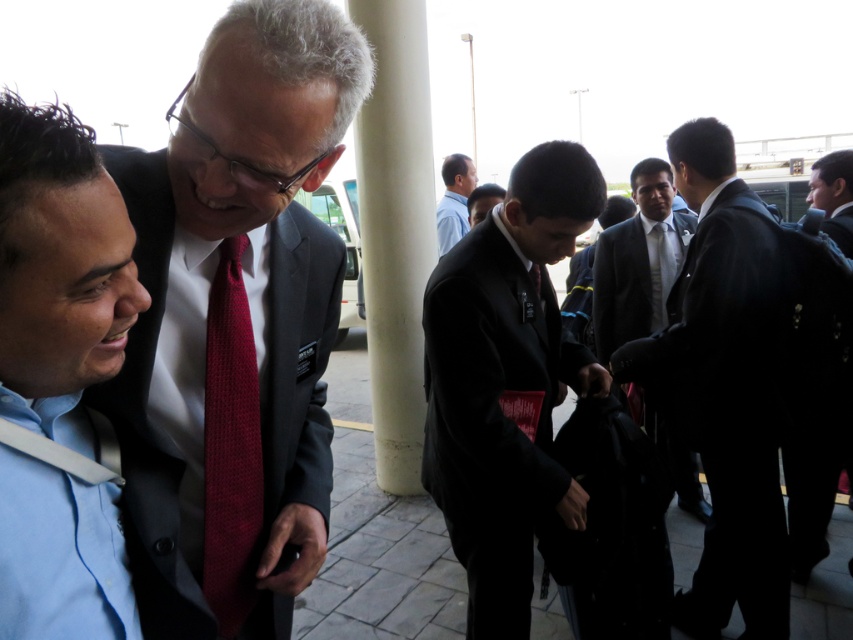
This screenshot has height=640, width=853. What are the coordinates of `matte black suit at center` in the screenshot? It's located at (235, 323).

Which is more to the right, matte black suit at center or black matte suit at center?

black matte suit at center

You are a GUI agent. You are given a task and a screenshot of the screen. Output one action in this format:
    pyautogui.click(x=<x>, y=<y>)
    Task: Click on the matte black suit at center
    Image resolution: width=853 pixels, height=640 pixels.
    Given the screenshot: What is the action you would take?
    pyautogui.click(x=235, y=323)

Where is `matte black suit at center`? The image size is (853, 640). matte black suit at center is located at coordinates (235, 323).

Is dark gray suit at center thinner than dark blue suit at center?

In fact, dark gray suit at center might be wider than dark blue suit at center.

Does dark gray suit at center have a greater width compared to dark blue suit at center?

Yes.

Is point (688, 467) farther from camera compared to point (485, 208)?

That is True.

The height and width of the screenshot is (640, 853). Identify the location of dark gray suit at center. (637, 260).

Can you confirm if matte black suit at center is positioned to the right of dark blue suit at center?

In fact, matte black suit at center is to the left of dark blue suit at center.

Which is more to the left, matte black suit at center or dark blue suit at center?

Positioned to the left is matte black suit at center.

Who is more distant from viewer, (257, 145) or (469, 227)?

Point (469, 227)

The height and width of the screenshot is (640, 853). Find the location of `matte black suit at center`. matte black suit at center is located at coordinates (235, 323).